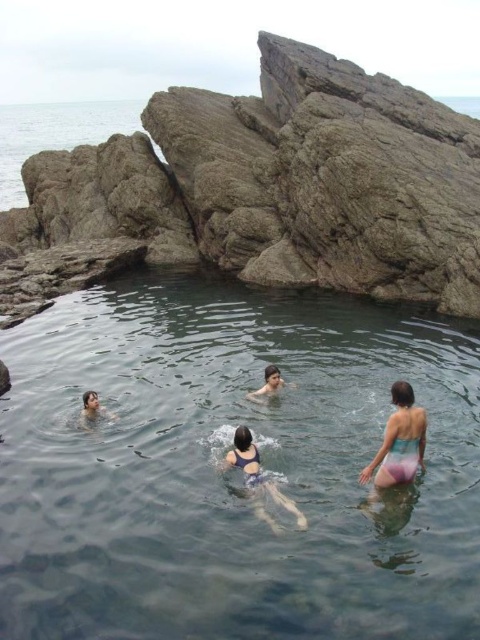
Looking at this image, can you confirm if gray rough rock at upper center is shorter than solid purple swimsuit at center?

In fact, gray rough rock at upper center may be taller than solid purple swimsuit at center.

Between point (370, 262) and point (240, 435), which one is positioned in front?

Point (240, 435)

Does point (110, 193) lie in front of point (271, 483)?

No, (110, 193) is further to viewer.

I want to click on gray rough rock at upper center, so click(x=269, y=188).

Can you confirm if solid purple swimsuit at center is thinner than light brown skin at center?

No.

Who is more forward, (261, 477) or (249, 394)?

Point (261, 477) is more forward.

You are a GUI agent. You are given a task and a screenshot of the screen. Output one action in this format:
    pyautogui.click(x=<x>, y=<y>)
    Task: Click on the solid purple swimsuit at center
    The image size is (480, 640).
    Given the screenshot: What is the action you would take?
    pyautogui.click(x=257, y=472)

Who is shorter, gray rock at upper left or matte black swimmer at lower left?

matte black swimmer at lower left

Between point (97, 118) and point (88, 396), which one is positioned in front?

Point (88, 396) is in front.

Does point (56, 131) come farther from viewer compared to point (90, 401)?

That is True.

Image resolution: width=480 pixels, height=640 pixels. Find the location of `gray rock at upper left`. gray rock at upper left is located at coordinates (56, 134).